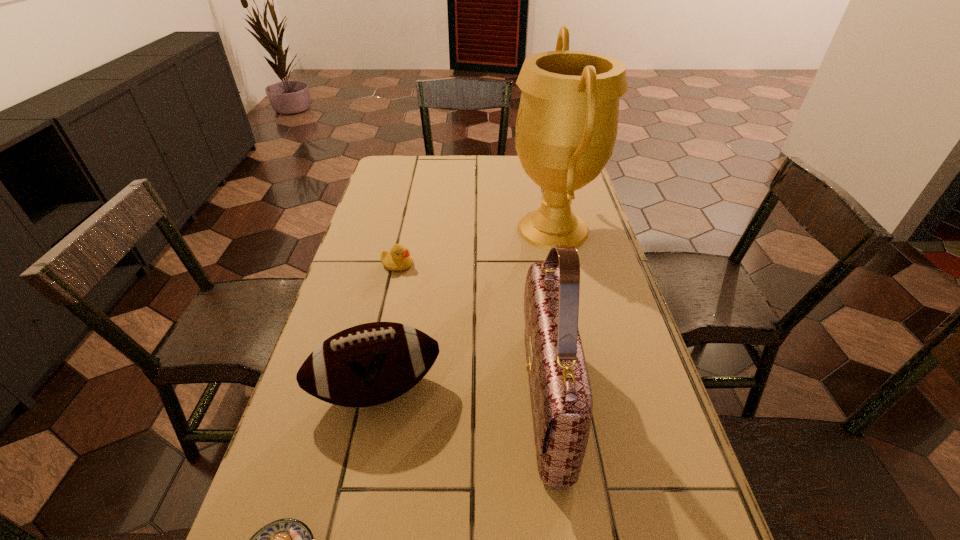
You are a GUI agent. You are given a task and a screenshot of the screen. Output one action in this format:
    pyautogui.click(x=<x>, y=<y>)
    Task: Click on the vacant space located 0.380m on the back of the football (American)
    Image resolution: width=960 pixels, height=540 pixels.
    Given the screenshot: What is the action you would take?
    pyautogui.click(x=405, y=253)

I want to click on vacant area located at the face of the second shortest object, so click(x=537, y=265).

Where is `football (American) at the left edge`? football (American) at the left edge is located at coordinates (369, 364).

Find the location of `duckling situated at the left edge`. duckling situated at the left edge is located at coordinates (398, 258).

At what (x,y) coordinates should I click in order to perform the action: click on object located in the right edge section of the desktop. Please return your answer as a coordinate pair (x, y). This screenshot has height=540, width=960. Looking at the image, I should click on (567, 122).

In the image, there is a desktop. Where is `vacant space at the far edge`? Image resolution: width=960 pixels, height=540 pixels. vacant space at the far edge is located at coordinates [x=505, y=156].

This screenshot has height=540, width=960. In the image, there is a desktop. In order to click on free region at the left edge in this screenshot , I will do `click(399, 286)`.

The image size is (960, 540). What are the coordinates of `vacant space at the right edge` in the screenshot? It's located at (573, 201).

The height and width of the screenshot is (540, 960). I want to click on free space at the far left corner of the desktop, so click(x=394, y=177).

You are a GUI agent. You are given a task and a screenshot of the screen. Output one action in this format:
    pyautogui.click(x=<x>, y=<y>)
    Task: Click on the vacant space in between the second shortest object and the second tallest object
    
    Given the screenshot: What is the action you would take?
    pyautogui.click(x=471, y=332)